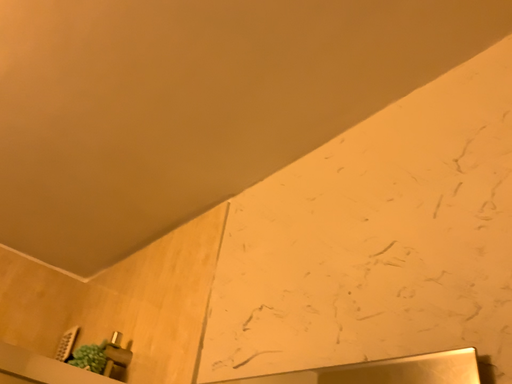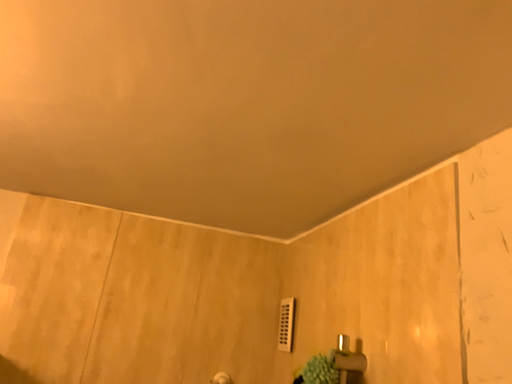
Question: Which way did the camera rotate in the video?

Choices:
 (A) rotated upward
 (B) rotated downward

Answer: (B)